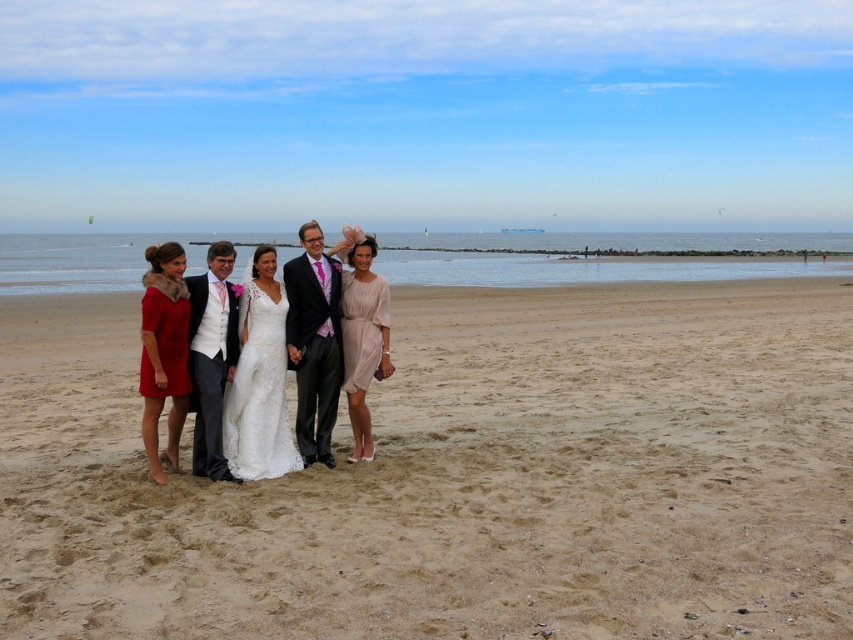
Question: Which point is closer to the camera?

Choices:
 (A) (306, 260)
 (B) (228, 413)

Answer: (B)

Question: Which object appears closest to the camera in this image?

Choices:
 (A) matte black suit at center
 (B) sandy beach at center
 (C) velvet red dress at left

Answer: (B)

Question: From the image, what is the correct spatial relationship of matte black suit at center in relation to matte beige dress at center?

Choices:
 (A) left
 (B) right

Answer: (A)

Question: Which of these objects is positioned farthest from the velvet red dress at left?

Choices:
 (A) white satin dress at center
 (B) matte beige dress at center
 (C) white lace dress at center

Answer: (B)

Question: Does white satin dress at center have a lesser width compared to matte black suit at center?

Choices:
 (A) no
 (B) yes

Answer: (A)

Question: Does sandy beach at center appear under white satin dress at center?

Choices:
 (A) yes
 (B) no

Answer: (B)